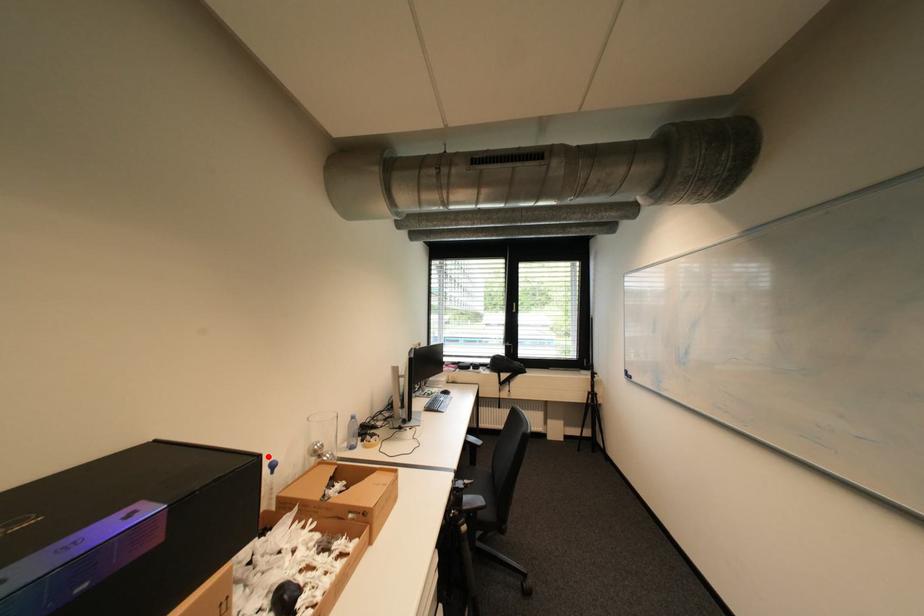
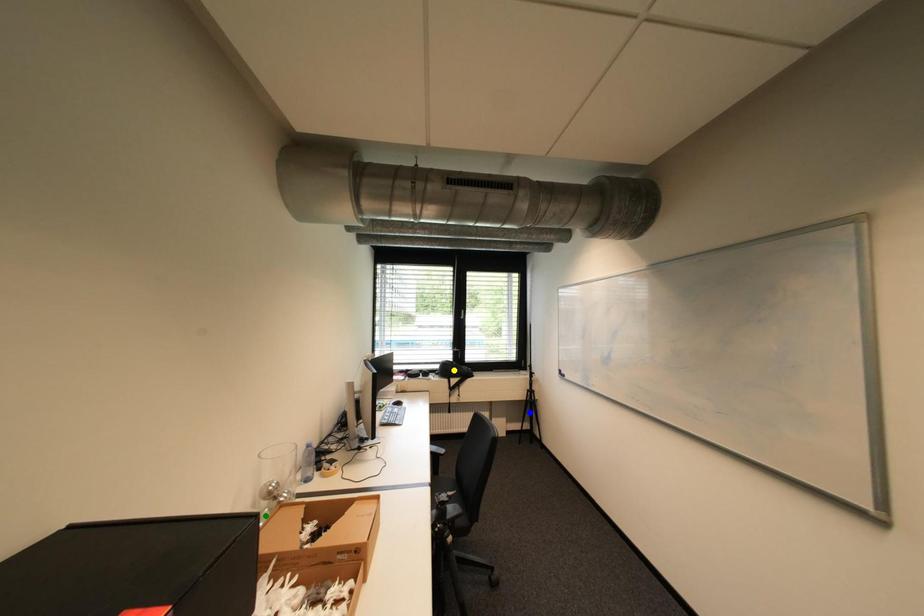
Question: I am providing you with two images of the same scene from different viewpoints. A red point is marked on the first image. You are given multiple points on the second image. Can you choose the point in image 2 that corresponds to the point in image 1?

Choices:
 (A) yellow point
 (B) green point
 (C) blue point

Answer: (B)